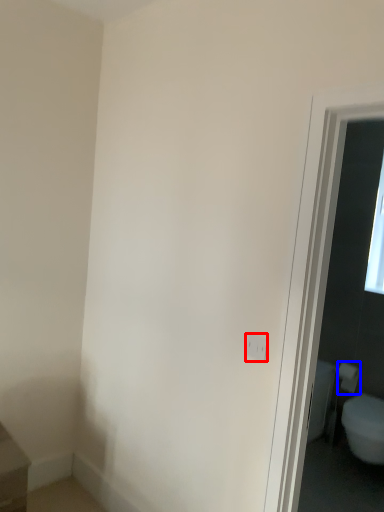
Question: Which point is closer to the camera, electric outlet (highlighted by a red box) or toilet paper (highlighted by a blue box)?

Choices:
 (A) electric outlet
 (B) toilet paper

Answer: (A)